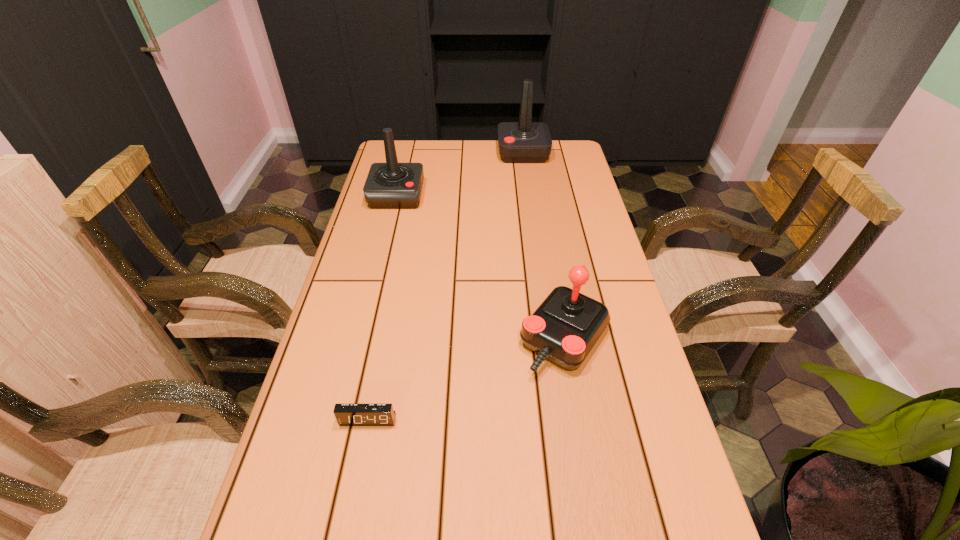
Locate an element on the screen. This screenshot has height=540, width=960. joystick that stands as the second closest to the farthest joystick is located at coordinates (564, 328).

This screenshot has width=960, height=540. Find the location of `joystick identified as the second closest to the farthest joystick`. joystick identified as the second closest to the farthest joystick is located at coordinates (564, 328).

You are a GUI agent. You are given a task and a screenshot of the screen. Output one action in this format:
    pyautogui.click(x=<x>, y=<y>)
    Task: Click on the vacant space that satisfies the following two spatial constraints: 1. on the front-facing side of the third farthest object; 2. on the right side of the second farthest object
    
    Given the screenshot: What is the action you would take?
    pyautogui.click(x=363, y=338)